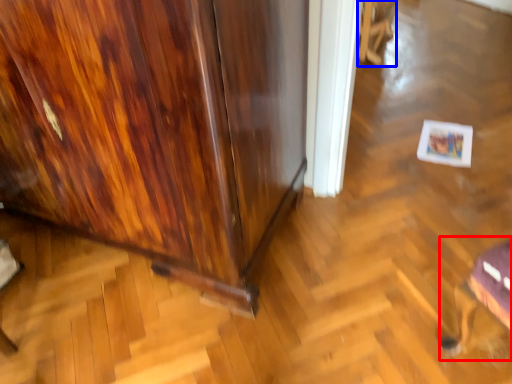
Question: Which of the following is the closest to the observer, swivel chair (highlighted by a red box) or swivel chair (highlighted by a blue box)?

Choices:
 (A) swivel chair
 (B) swivel chair

Answer: (A)